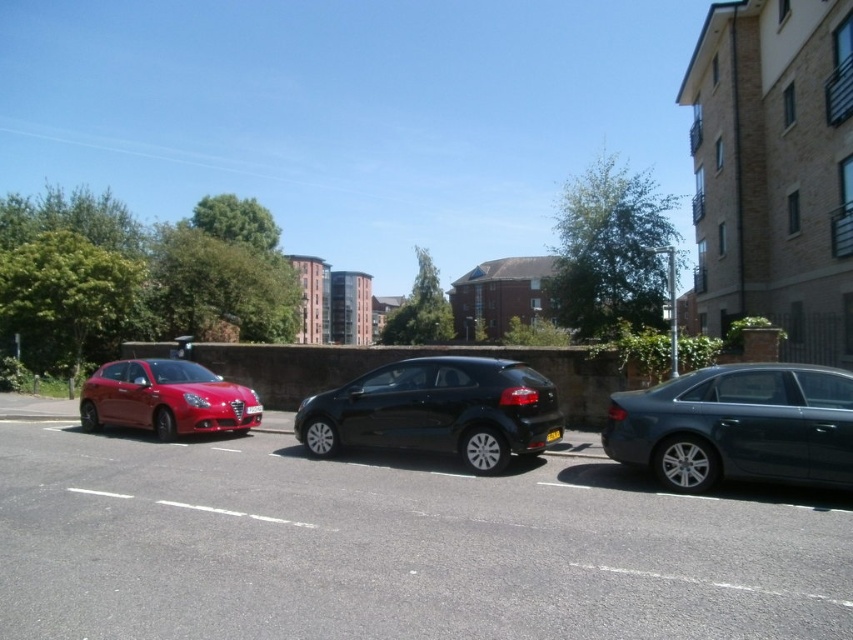
Does satin dark gray sedan at right appear under matte red hatchback at left?

No.

Where is `satin dark gray sedan at right`? This screenshot has height=640, width=853. satin dark gray sedan at right is located at coordinates (737, 426).

Is point (804, 470) behind point (163, 388)?

No, it is not.

Where is `satin dark gray sedan at right`? satin dark gray sedan at right is located at coordinates (737, 426).

Is glossy metallic car at center shorter than satin dark gray sedan at right?

Correct, glossy metallic car at center is not as tall as satin dark gray sedan at right.

Who is shorter, glossy metallic car at center or satin dark gray sedan at right?

Standing shorter between the two is glossy metallic car at center.

Which is in front, point (202, 496) or point (785, 433)?

Point (785, 433)

This screenshot has width=853, height=640. Find the location of `glossy metallic car at center`. glossy metallic car at center is located at coordinates point(392,547).

Image resolution: width=853 pixels, height=640 pixels. What do you see at coordinates (737, 426) in the screenshot?
I see `satin dark gray sedan at right` at bounding box center [737, 426].

Does satin dark gray sedan at right appear on the left side of glossy black hatchback at center?

Incorrect, satin dark gray sedan at right is not on the left side of glossy black hatchback at center.

Is point (822, 408) positioned before point (515, 368)?

That is True.

At what (x,y) coordinates should I click in order to perform the action: click on satin dark gray sedan at right. Please return your answer as a coordinate pair (x, y). Looking at the image, I should click on (737, 426).